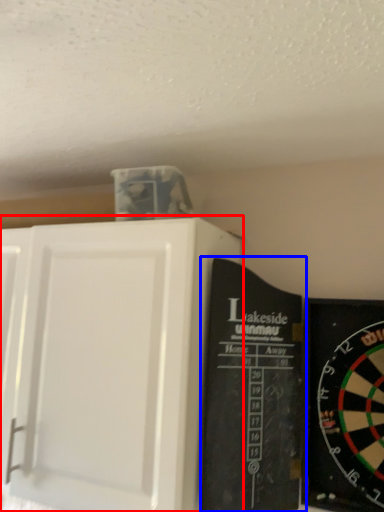
Question: Which object is further to the camera taking this photo, cupboard (highlighted by a red box) or bulletin board (highlighted by a blue box)?

Choices:
 (A) cupboard
 (B) bulletin board

Answer: (A)